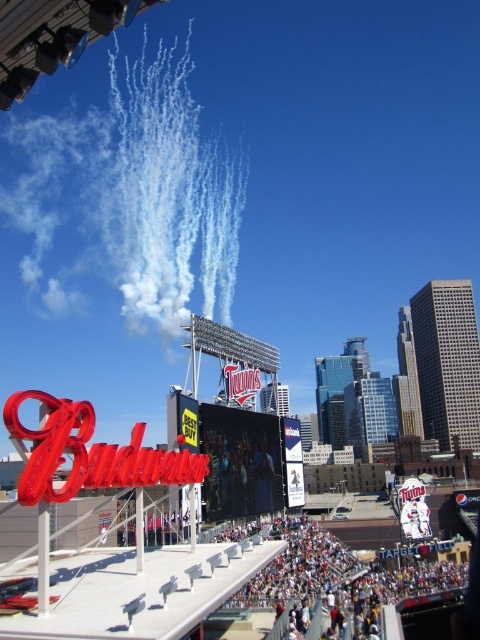
You are a photographer at Target Field and want to capture a photo of the white vapor trails at upper center and the white cotton crowd at lower center. Which object in the image is bigger?

The white vapor trails at upper center is larger in size than white cotton crowd at lower center.

You are a photographer at Target Field and want to capture the white vapor trails at upper center and the white cotton crowd at lower center in the same frame. Which object should you pan your camera to the right to include?

You should pan your camera to the right to include the white cotton crowd at lower center because the white vapor trails at upper center are located to the left of the white cotton crowd at lower center.